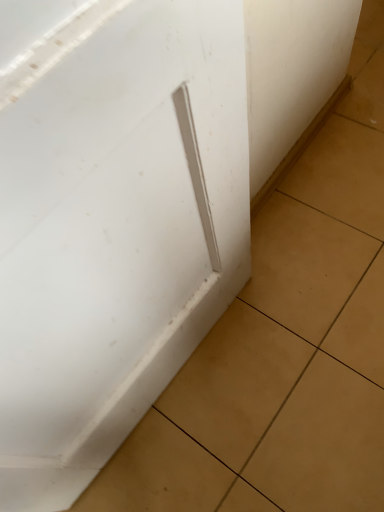
Locate an element on the screen. white glossy bathtub at center is located at coordinates (115, 232).

What do you see at coordinates (115, 232) in the screenshot?
I see `white glossy bathtub at center` at bounding box center [115, 232].

The image size is (384, 512). Find the location of `white glossy bathtub at center`. white glossy bathtub at center is located at coordinates (115, 232).